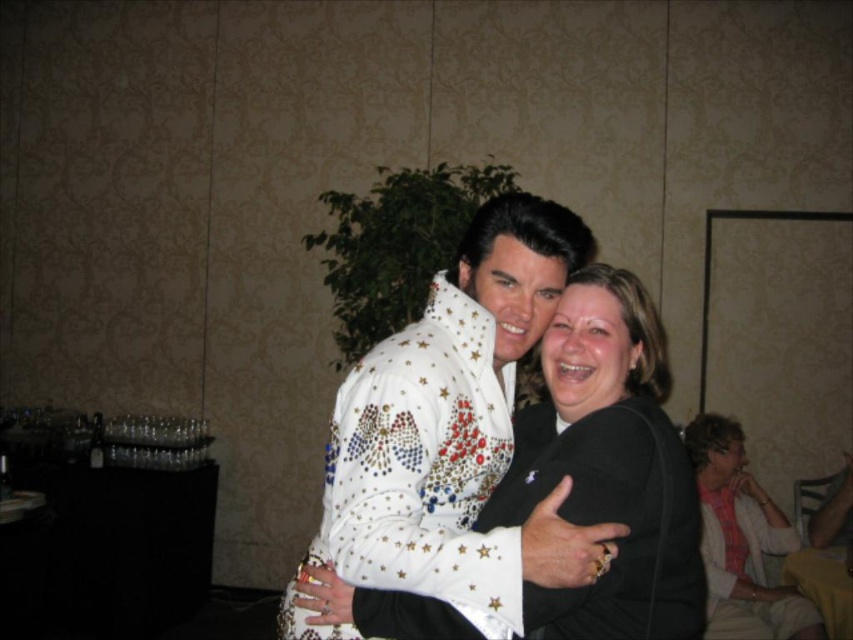
Between white sequined dress at center and plaid shirt at right, which one appears on the right side from the viewer's perspective?

Positioned to the right is plaid shirt at right.

Does white sequined dress at center have a smaller size compared to plaid shirt at right?

Yes, white sequined dress at center is smaller than plaid shirt at right.

Image resolution: width=853 pixels, height=640 pixels. What do you see at coordinates (425, 467) in the screenshot? I see `white sequined dress at center` at bounding box center [425, 467].

Identify the location of white sequined dress at center. (425, 467).

Is point (531, 493) less distant than point (421, 508)?

No.

Does white sequined jacket at center have a greater width compared to white sequined dress at center?

Indeed, white sequined jacket at center has a greater width compared to white sequined dress at center.

Is point (561, 328) farther from viewer compared to point (421, 515)?

Yes, it is behind point (421, 515).

This screenshot has height=640, width=853. I want to click on white sequined jacket at center, so click(x=607, y=468).

Does point (572, 609) come closer to viewer compared to point (756, 534)?

That is True.

Who is taller, white sequined jacket at center or plaid shirt at right?

plaid shirt at right is taller.

The height and width of the screenshot is (640, 853). What do you see at coordinates (607, 468) in the screenshot?
I see `white sequined jacket at center` at bounding box center [607, 468].

What are the coordinates of `white sequined jacket at center` in the screenshot? It's located at (607, 468).